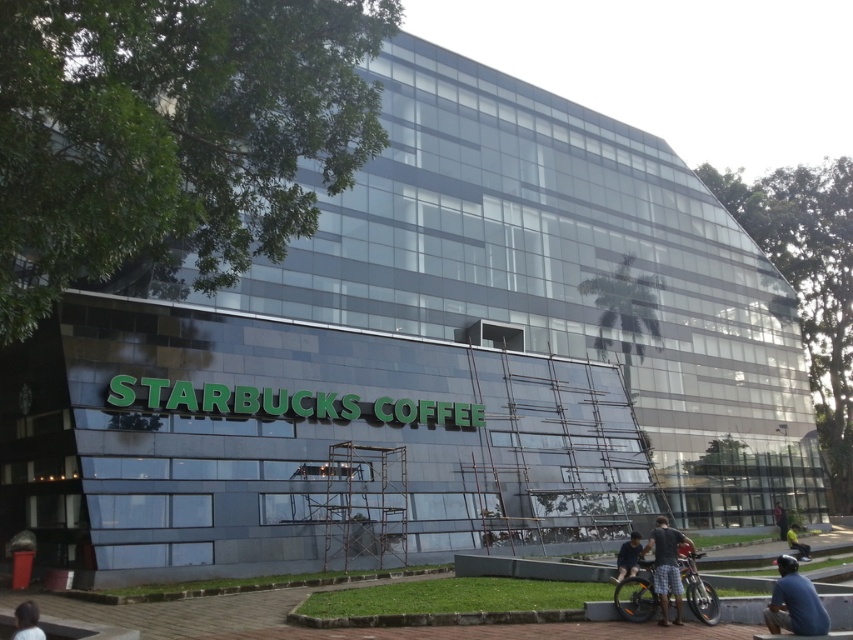
You are a delivery person who needs to park your orange matte bicycle at lower right and blue fabric cap at lower right near the Starbucks entrance. Given that the parking space is only 1.2 meters wide, can both items fit side by side?

The orange matte bicycle at lower right has a lesser width compared to blue fabric cap at lower right. However, without knowing the exact widths of both items, it is impossible to determine if their combined width exceeds the 1.2 meters parking space. Additional measurements are needed.

You are standing at the entrance of the Starbucks Coffee shop in front of the glass building. You notice two points marked on the glass wall. One is at coordinate point (33, 637) and the other at point (792, 529). From your perspective, which point is closer to you?

Point (33, 637) is in front of point (792, 529), so it is closer to you.